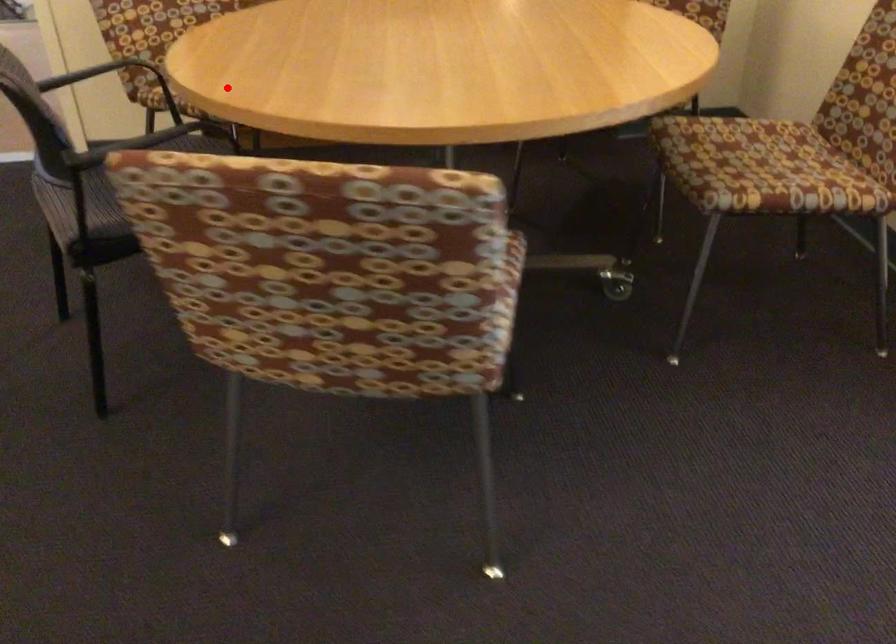
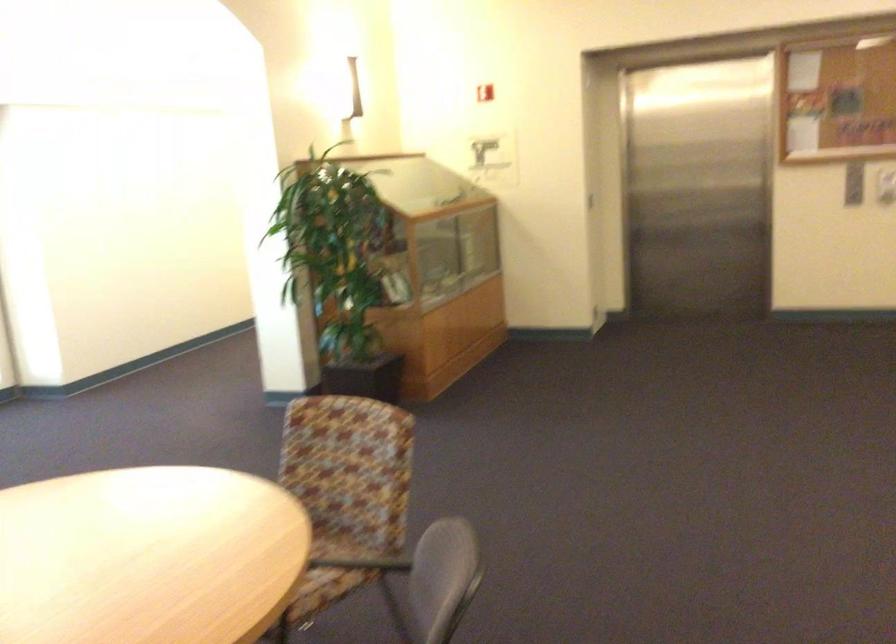
Find the pixel in the second image that matches the highlighted location in the first image.

(288, 535)